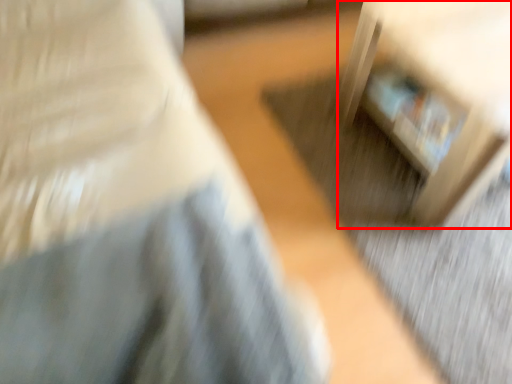
Question: From the image, what is the correct spatial relationship of furniture (annotated by the red box) in relation to furniture?

Choices:
 (A) right
 (B) left

Answer: (A)